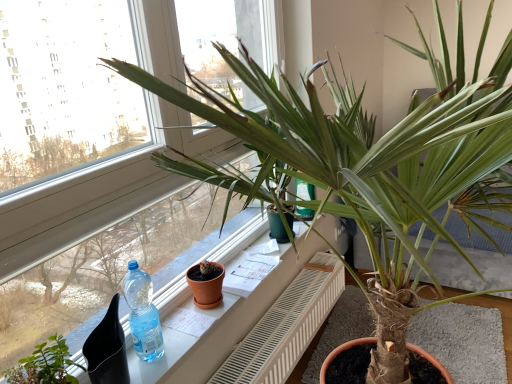
You are a GUI agent. You are given a task and a screenshot of the screen. Output one action in this format:
    pyautogui.click(x=<x>, y=<y>)
    Task: Click on the free space to the right of transparent plastic bottle at window
    This screenshot has height=384, width=512.
    Given the screenshot: What is the action you would take?
    pyautogui.click(x=186, y=339)